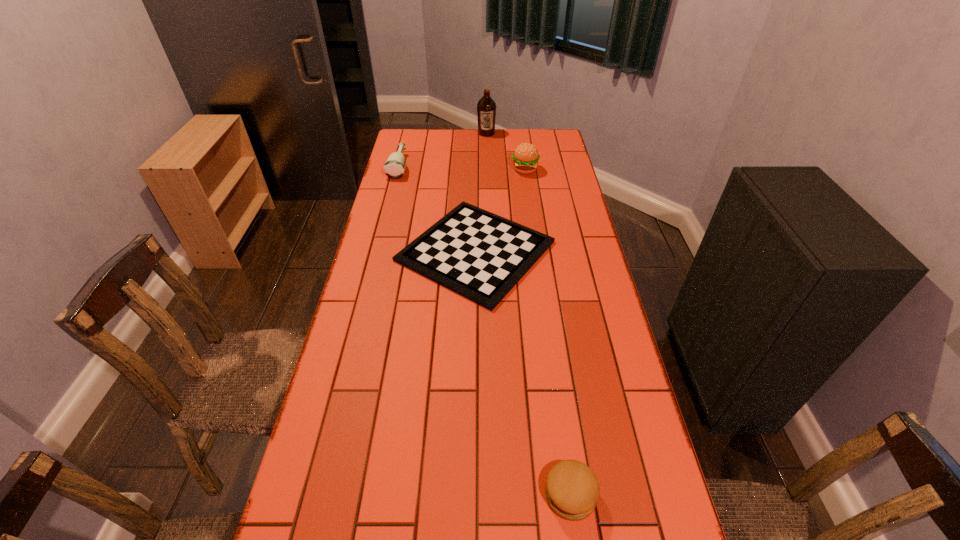
Where is `free spot located on the front of the fourth shortest object`? free spot located on the front of the fourth shortest object is located at coordinates pos(534,234).

At what (x,y) coordinates should I click in order to perform the action: click on vacant space situated on the right of the bottle. Please return your answer as a coordinate pair (x, y). The height and width of the screenshot is (540, 960). Looking at the image, I should click on (444, 166).

At what (x,y) coordinates should I click in order to perform the action: click on vacant point located 0.090m on the right of the second shortest object. Please return your answer as a coordinate pair (x, y). The height and width of the screenshot is (540, 960). Looking at the image, I should click on (638, 495).

I want to click on vacant space located 0.220m on the back of the fourth farthest object, so click(x=476, y=174).

Where is `olive oil that is at the far edge`? This screenshot has height=540, width=960. olive oil that is at the far edge is located at coordinates click(x=486, y=108).

This screenshot has width=960, height=540. Find the location of `bottle positioned at the far edge`. bottle positioned at the far edge is located at coordinates (394, 167).

Where is `bottle present at the left edge`? bottle present at the left edge is located at coordinates (394, 167).

Find the location of a particular element. This screenshot has width=960, height=540. checkerboard that is at the left edge is located at coordinates (479, 255).

Identify the location of checkerboard positioned at the right edge. The image size is (960, 540). (479, 255).

You are a GUI agent. You are given a task and a screenshot of the screen. Output one action in this format:
    pyautogui.click(x=<x>, y=<y>)
    Task: Click on the object that is at the far left corner
    
    Given the screenshot: What is the action you would take?
    pos(394,167)